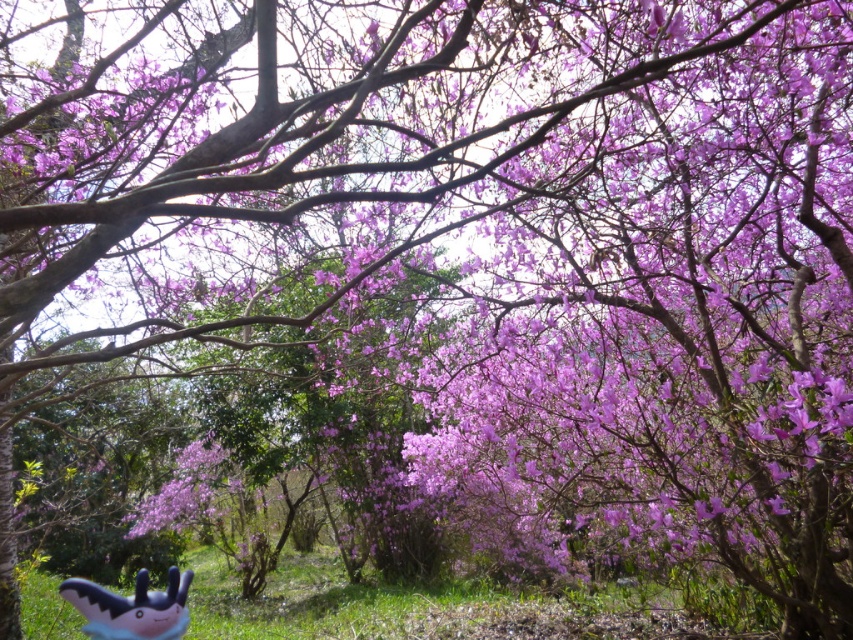
Question: Which point is farther to the camera?

Choices:
 (A) (202, 506)
 (B) (183, 609)

Answer: (A)

Question: Is matte purple flower at center to the right of plush toy at lower left from the viewer's perspective?

Choices:
 (A) yes
 (B) no

Answer: (B)

Question: Observing the image, what is the correct spatial positioning of matte purple flower at center in reference to plush toy at lower left?

Choices:
 (A) left
 (B) right

Answer: (A)

Question: Does matte purple flower at center appear on the left side of plush toy at lower left?

Choices:
 (A) yes
 (B) no

Answer: (A)

Question: Which object is closer to the camera taking this photo?

Choices:
 (A) matte purple flower at center
 (B) plush toy at lower left

Answer: (B)